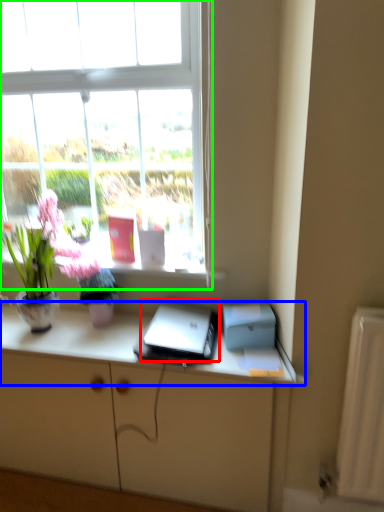
Question: Considering the real-world distances, which object is closest to laptop (highlighted by a red box)? desk (highlighted by a blue box) or window (highlighted by a green box).

Choices:
 (A) desk
 (B) window

Answer: (A)